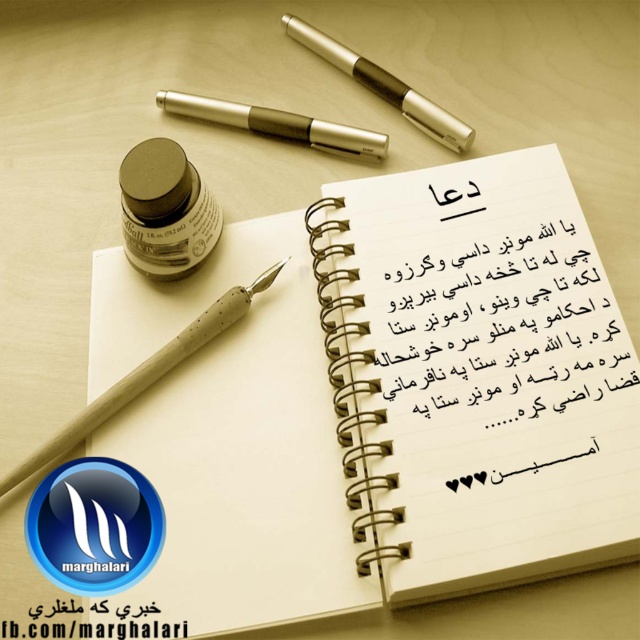
Between point (186, 113) and point (442, 131), which one is positioned in front?

Positioned in front is point (442, 131).

Which is below, metallic pen at center or metallic pen at upper center?

metallic pen at center

Does point (228, 116) lie behind point (376, 93)?

No, it is not.

Image resolution: width=640 pixels, height=640 pixels. I want to click on metallic pen at center, so click(x=278, y=124).

Which is behind, point (572, 406) or point (198, 333)?

Positioned behind is point (198, 333).

Find the location of a particular element. white paper at center is located at coordinates (499, 324).

Does matte black ink bottle at upper left have a lesser width compared to metallic pen at upper center?

Yes, matte black ink bottle at upper left is thinner than metallic pen at upper center.

Is matte black ink bottle at upper left above metallic pen at upper center?

No.

Does point (145, 150) come in front of point (419, 96)?

Yes.

Identify the location of matte black ink bottle at upper left. (164, 209).